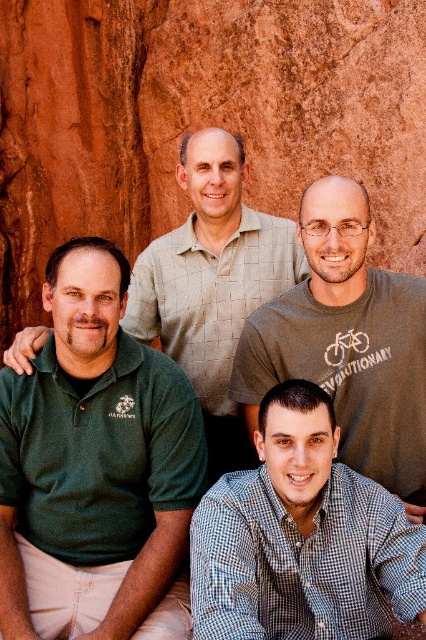
You are a photographer trying to capture a clear shot of the checkered shirt at lower center and the green cotton polo shirt at upper center. Which shirt should you focus on to ensure it appears sharp in the photo?

You should focus on the checkered shirt at lower center because it is in front of the green cotton polo shirt at upper center, making it closer to the camera and thus easier to capture sharply.

You are standing at the point marked as point (353, 381) in the image. You want to walk to the nearest rock formation. The nearest rock formation is 107.83 feet away from you. Can you walk directly to it without any obstacles?

Yes, since the distance between point (353, 381) and the viewer is 107.83 feet, you can walk directly to the nearest rock formation without any obstacles as there are no mentioned obstacles in the scene description.